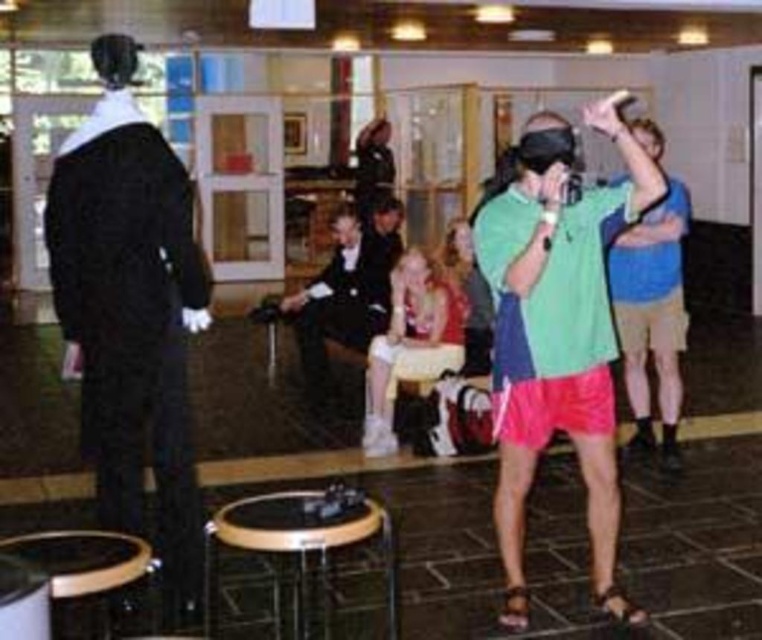
You are a photographer standing in the scene and want to take a clear photo of both the matte pink dress at center and the matte black nun at center. Which object should you focus on first to ensure both are in focus?

You should focus on the matte pink dress at center first because it is closer to the viewer than the matte black nun at center. By focusing on the closer object, the depth of field may allow both to be in focus, especially if using a small aperture or a lens with good depth of field characteristics.

You are a guest at the event and want to take a photo of both the matte pink dress at center and the black formal suit at center. Which one should you focus on first if you want to capture both in a single frame without moving your camera?

The matte pink dress at center is below the black formal suit at center, so you should focus on the black formal suit at center first to ensure both are in the frame.